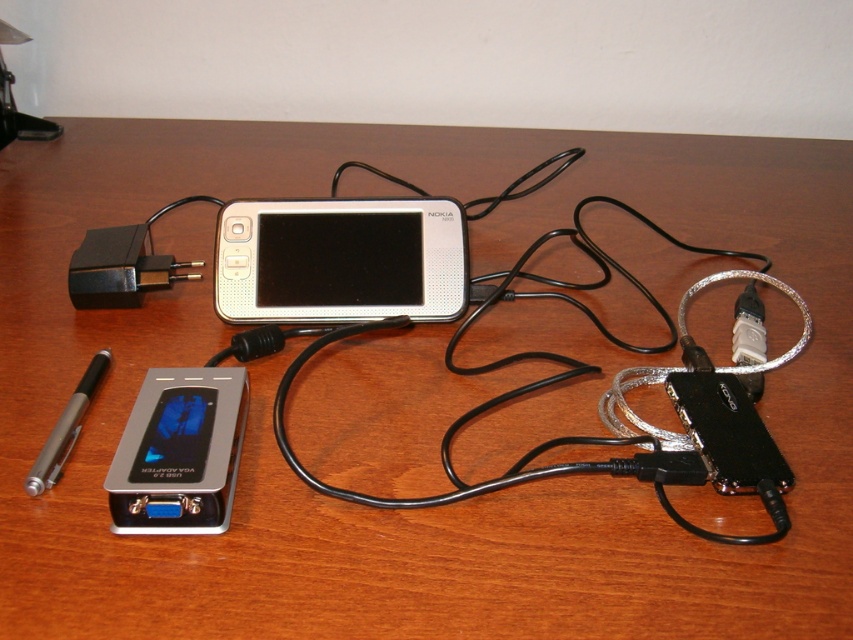
Does silver metallic nokia phone at center appear over silver metallic vga adapter at lower left?

Indeed, silver metallic nokia phone at center is positioned over silver metallic vga adapter at lower left.

The width and height of the screenshot is (853, 640). What are the coordinates of `silver metallic nokia phone at center` in the screenshot? It's located at (340, 259).

Does silver metallic vga adapter at lower left appear under silver metallic pen at lower left?

Correct, silver metallic vga adapter at lower left is located below silver metallic pen at lower left.

Looking at this image, which is below, silver metallic vga adapter at lower left or silver metallic pen at lower left?

silver metallic vga adapter at lower left is lower down.

Which is behind, point (112, 504) or point (51, 451)?

The point (51, 451) is behind.

Image resolution: width=853 pixels, height=640 pixels. In order to click on silver metallic vga adapter at lower left in this screenshot , I will do `click(178, 452)`.

Is point (434, 307) in front of point (77, 401)?

No, it is not.

Does silver metallic nokia phone at center appear over silver metallic pen at lower left?

Yes.

What are the coordinates of `silver metallic nokia phone at center` in the screenshot? It's located at (340, 259).